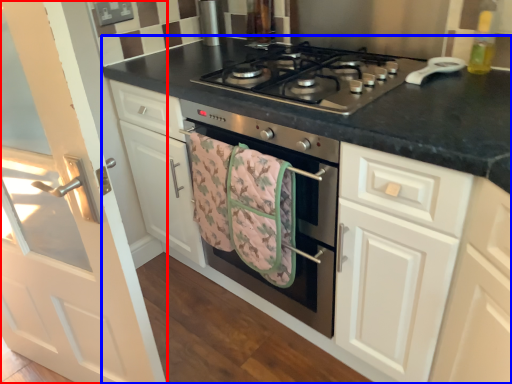
Question: Which point is further to the camera, door (highlighted by a red box) or countertop (highlighted by a blue box)?

Choices:
 (A) door
 (B) countertop

Answer: (B)